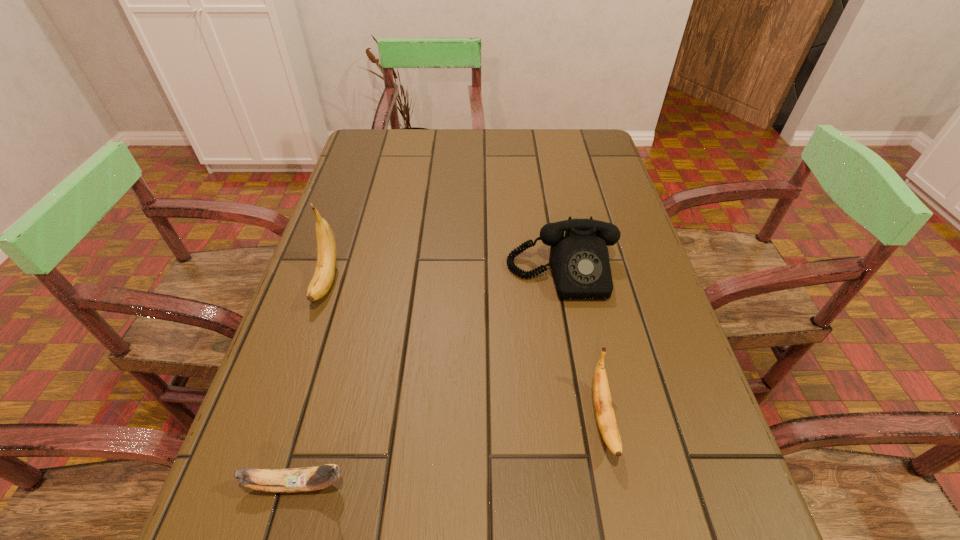
This screenshot has width=960, height=540. What are the coordinates of `free space that is in between the nearest object and the rightmost banana` in the screenshot? It's located at 450,451.

Identify the location of empty location between the nearest banana and the second nearest banana. (450, 451).

Image resolution: width=960 pixels, height=540 pixels. What are the coordinates of `empty space that is in between the farthest banana and the telephone` in the screenshot? It's located at (444, 278).

This screenshot has height=540, width=960. What are the coordinates of `free space between the nearest object and the tallest object` in the screenshot? It's located at (312, 383).

Where is `vacant area between the nearest object and the second farthest banana`? The image size is (960, 540). vacant area between the nearest object and the second farthest banana is located at coordinates (450, 451).

You are a GUI agent. You are given a task and a screenshot of the screen. Output one action in this format:
    pyautogui.click(x=<x>, y=<y>)
    Task: Click on the object that stands as the third closest to the telephone
    Image resolution: width=960 pixels, height=540 pixels.
    Given the screenshot: What is the action you would take?
    pyautogui.click(x=318, y=477)

Find the location of a particular element. object that is the closest to the rightmost banana is located at coordinates (579, 261).

Locate an element on the screen. banana that is the closest to the third shortest object is located at coordinates (604, 411).

Identify which banana is the closest to the third shortest object. Please provide its 2D coordinates. Your answer should be formatted as a tuple, i.e. [(x, y)], where the tuple contains the x and y coordinates of a point satisfying the conditions above.

[(604, 411)]

Image resolution: width=960 pixels, height=540 pixels. In order to click on free point that satisfies the following two spatial constraints: 1. on the peel of the second nearest banana from the top; 2. at the stem of the nearest object in this screenshot , I will do `click(616, 484)`.